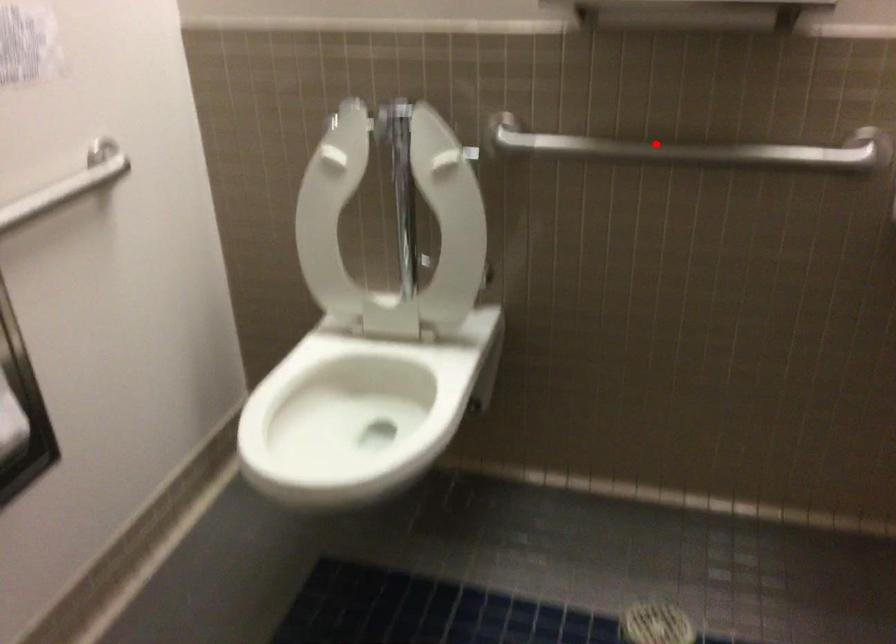
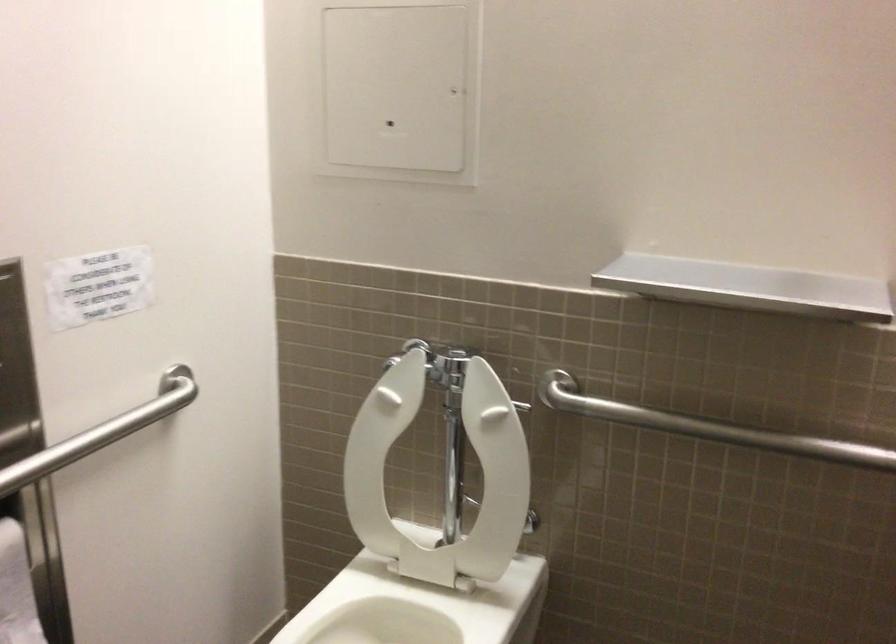
Find the pixel in the second image that matches the highlighted location in the first image.

(709, 427)